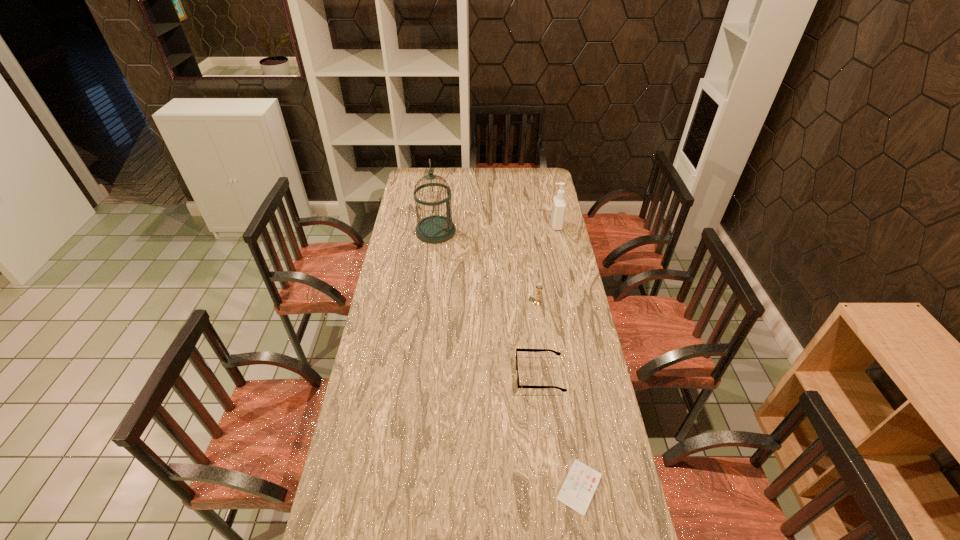
Identify the location of the leftmost object. The image size is (960, 540). (435, 229).

Identify the location of the tallest object. (435, 229).

In order to click on the fourth shortest object in this screenshot , I will do `click(559, 204)`.

Image resolution: width=960 pixels, height=540 pixels. Identify the location of the third tallest object. (538, 287).

I want to click on the third farthest object, so click(538, 287).

Identify the location of the second shortest object. This screenshot has width=960, height=540. (517, 349).

I want to click on the fourth farthest object, so click(517, 349).

Find the location of a particular element. The image size is (960, 540). diary is located at coordinates (581, 482).

What are the coordinates of `the shortest object` in the screenshot? It's located at (581, 482).

The image size is (960, 540). Find the location of `vacant space located 0.370m on the front-facing side of the tallest object`. vacant space located 0.370m on the front-facing side of the tallest object is located at coordinates (527, 232).